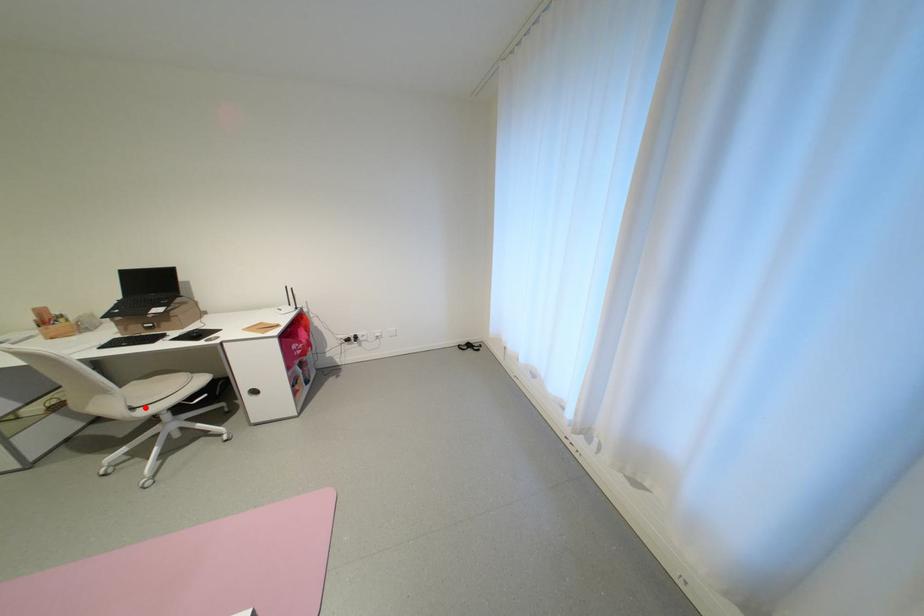
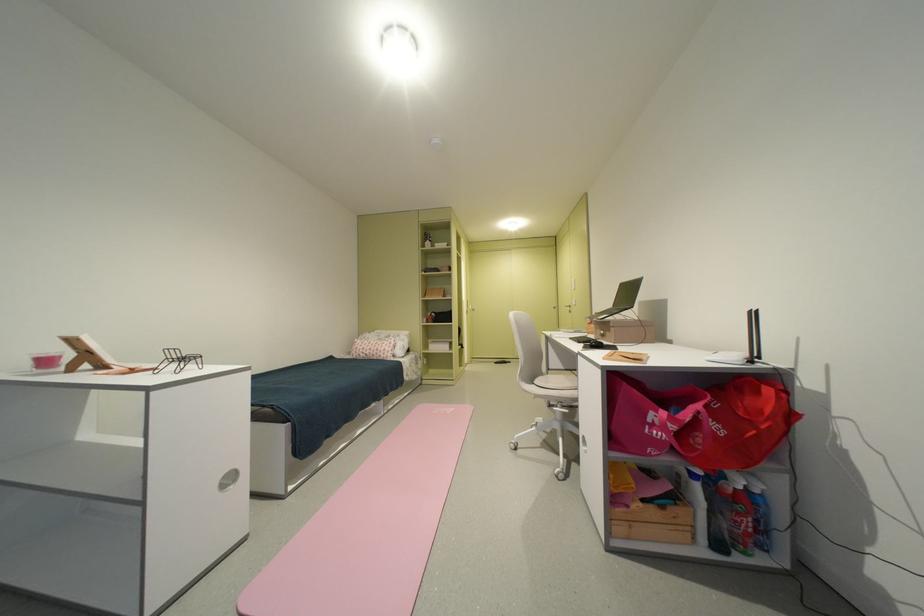
Question: I am providing you with two images of the same scene from different viewpoints. Image1 has a red point marked. In image2, the corresponding 3D location appears at what relative position? Reply with the corresponding letter.

Choices:
 (A) Closer
 (B) Farther

Answer: (B)